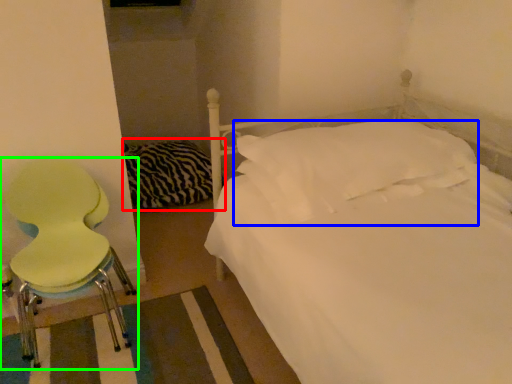
Question: Estimate the real-world distances between objects in this image. Which object is closer to bedding (highlighted by a red box), pillow (highlighted by a blue box) or chair (highlighted by a green box)?

Choices:
 (A) pillow
 (B) chair

Answer: (B)